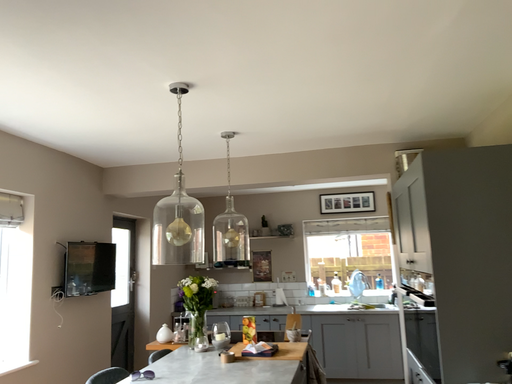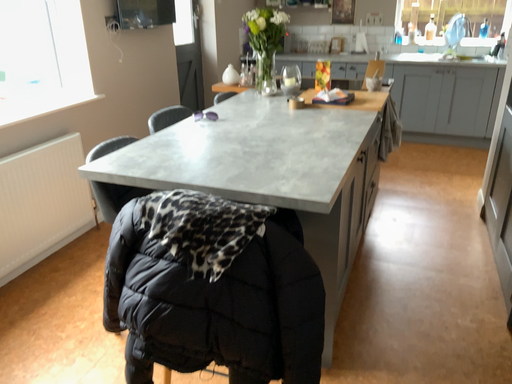
Question: How did the camera likely rotate when shooting the video?

Choices:
 (A) rotated upward
 (B) rotated downward

Answer: (B)